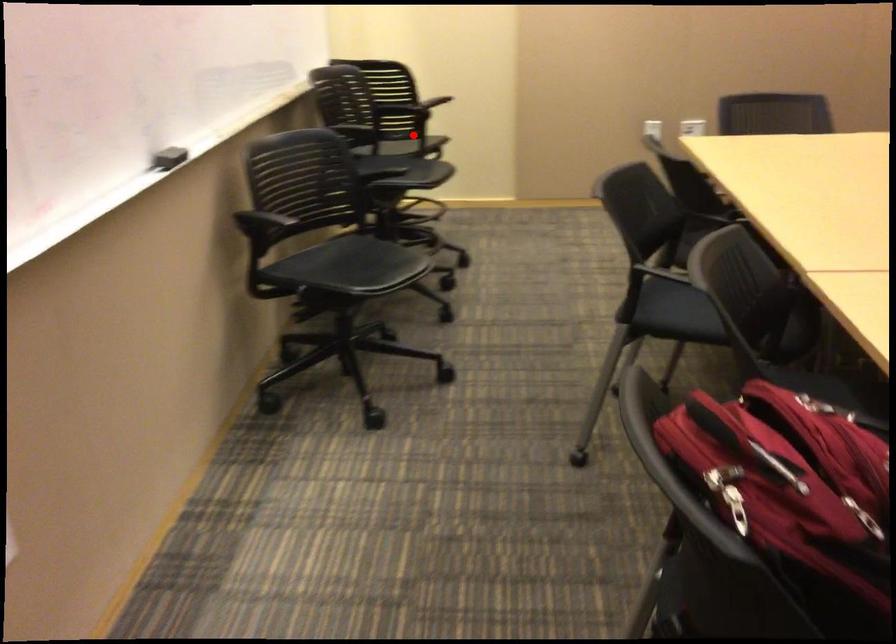
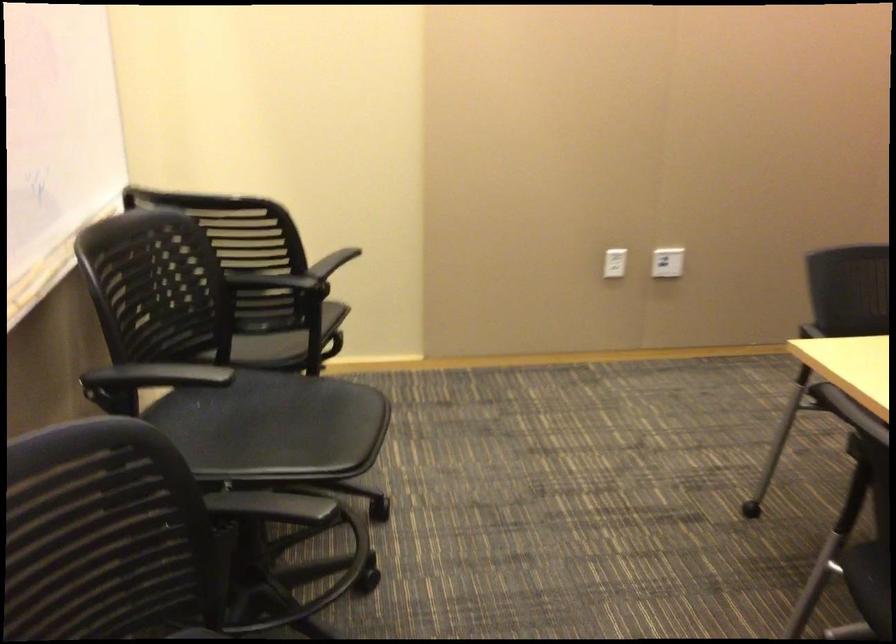
In the second image, find the point that corresponds to the highlighted location in the first image.

(287, 341)